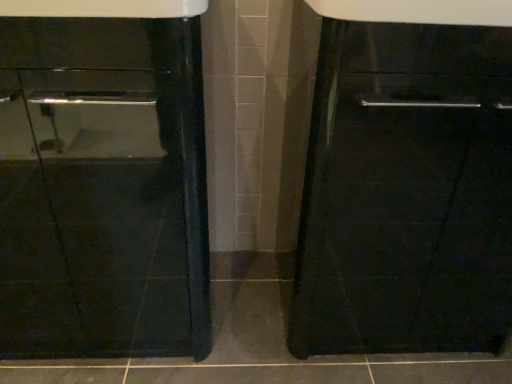
What is the approximate height of glossy black sink at center?

It is 32.40 inches.

This screenshot has height=384, width=512. What do you see at coordinates (104, 185) in the screenshot?
I see `glossy black sink at center` at bounding box center [104, 185].

Image resolution: width=512 pixels, height=384 pixels. I want to click on glossy black sink at center, so click(104, 185).

You are a GUI agent. You are given a task and a screenshot of the screen. Output one action in this format:
    pyautogui.click(x=<x>, y=<y>)
    Task: Click on the glossy black cabinet at right
    
    Given the screenshot: What is the action you would take?
    pyautogui.click(x=406, y=192)

What do you see at coordinates (406, 192) in the screenshot? I see `glossy black cabinet at right` at bounding box center [406, 192].

This screenshot has height=384, width=512. In order to click on glossy black sink at center in this screenshot , I will do `click(104, 185)`.

Based on their positions, is glossy black sink at center located to the left or right of glossy black cabinet at right?

Based on their positions, glossy black sink at center is located to the left of glossy black cabinet at right.

Considering the relative positions of glossy black sink at center and glossy black cabinet at right in the image provided, is glossy black sink at center behind glossy black cabinet at right?

No, glossy black sink at center is in front of glossy black cabinet at right.

Considering the points (168, 89) and (305, 220), which point is in front, point (168, 89) or point (305, 220)?

The point (168, 89) is closer to the camera.

From the image's perspective, is glossy black sink at center above or below glossy black cabinet at right?

glossy black sink at center is below glossy black cabinet at right.

Consider the image. From a real-world perspective, is glossy black sink at center positioned above or below glossy black cabinet at right?

glossy black sink at center is situated lower than glossy black cabinet at right in the real world.

Which of these two, glossy black sink at center or glossy black cabinet at right, is thinner?

glossy black cabinet at right is thinner.

Considering the relative sizes of glossy black sink at center and glossy black cabinet at right in the image provided, is glossy black sink at center shorter than glossy black cabinet at right?

In fact, glossy black sink at center may be taller than glossy black cabinet at right.

Considering the sizes of objects glossy black sink at center and glossy black cabinet at right in the image provided, who is smaller, glossy black sink at center or glossy black cabinet at right?

glossy black cabinet at right.

From the picture: Can we say glossy black sink at center lies outside glossy black cabinet at right?

Yes.

Can you see glossy black sink at center touching glossy black cabinet at right?

No, glossy black sink at center is not with glossy black cabinet at right.

Looking at this image, could you tell me if glossy black sink at center is facing glossy black cabinet at right?

No, glossy black sink at center is not aimed at glossy black cabinet at right.

How many degrees apart are the facing directions of glossy black sink at center and glossy black cabinet at right?

0.00372 degrees separate the facing orientations of glossy black sink at center and glossy black cabinet at right.

This screenshot has width=512, height=384. I want to click on cabinetry above the glossy black sink at center (from a real-world perspective), so click(x=406, y=192).

Which is more to the right, glossy black cabinet at right or glossy black sink at center?

From the viewer's perspective, glossy black cabinet at right appears more on the right side.

Looking at this image, which object is more forward, glossy black cabinet at right or glossy black sink at center?

glossy black sink at center is more forward.

Which is closer, (435, 154) or (86, 337)?

Point (435, 154) appears to be closer to the viewer than point (86, 337).

From the image's perspective, who appears lower, glossy black cabinet at right or glossy black sink at center?

glossy black sink at center.

From a real-world perspective, is glossy black cabinet at right over glossy black sink at center?

Yes, from a real-world perspective, glossy black cabinet at right is on top of glossy black sink at center.

Consider the image. Considering the sizes of objects glossy black cabinet at right and glossy black sink at center in the image provided, who is thinner, glossy black cabinet at right or glossy black sink at center?

Thinner between the two is glossy black cabinet at right.

Between glossy black cabinet at right and glossy black sink at center, which one has less height?

glossy black cabinet at right.

Is glossy black cabinet at right bigger than glossy black sink at center?

No, glossy black cabinet at right is not bigger than glossy black sink at center.

Is glossy black cabinet at right inside the boundaries of glossy black sink at center, or outside?

glossy black cabinet at right is not inside glossy black sink at center, it's outside.

Is glossy black cabinet at right next to glossy black sink at center and touching it?

No, glossy black cabinet at right is not with glossy black sink at center.

Is glossy black cabinet at right facing towards glossy black sink at center?

No, glossy black cabinet at right does not turn towards glossy black sink at center.

How many degrees apart are the facing directions of glossy black cabinet at right and glossy black sink at center?

0.00372 degrees.

This screenshot has width=512, height=384. In order to click on cabinetry above the glossy black sink at center (from a real-world perspective) in this screenshot , I will do `click(406, 192)`.

The image size is (512, 384). Identify the location of cabinetry above the glossy black sink at center (from a real-world perspective). (406, 192).

Where is `sink on the left of glossy black cabinet at right`? The width and height of the screenshot is (512, 384). sink on the left of glossy black cabinet at right is located at coordinates coord(104,185).